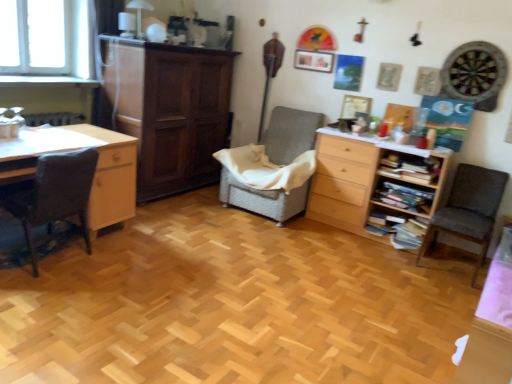
I want to click on vacant area in front of dark gray fabric chair at left, the first chair from the left, so [x=40, y=297].